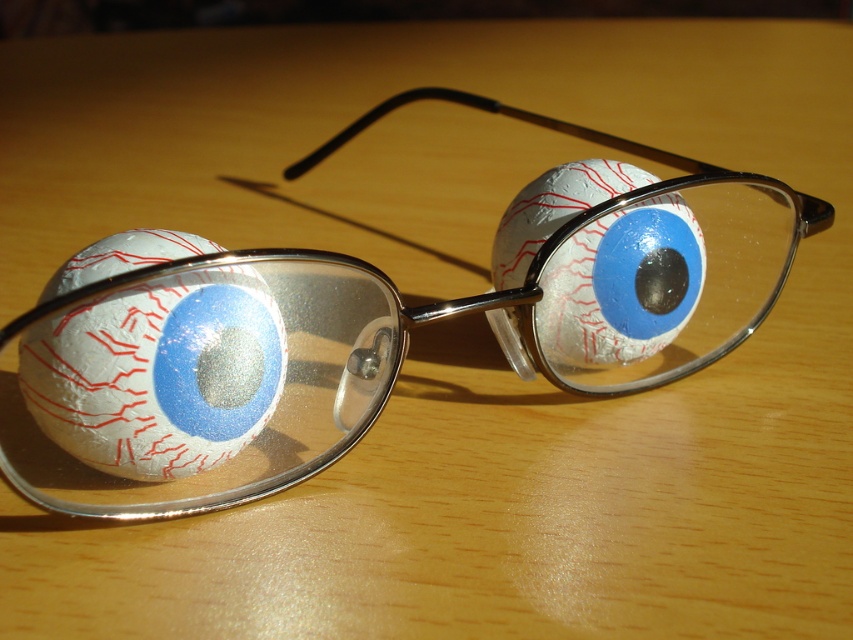
You are a character in a steampunk story and need to place a map on your desk so that it doesn not block the metallic silver goggles at center. Where should you place the map?

The metallic silver goggles at center are located at coordinates point (366, 337), so placing the map anywhere else on the desk except that point would avoid blocking them.